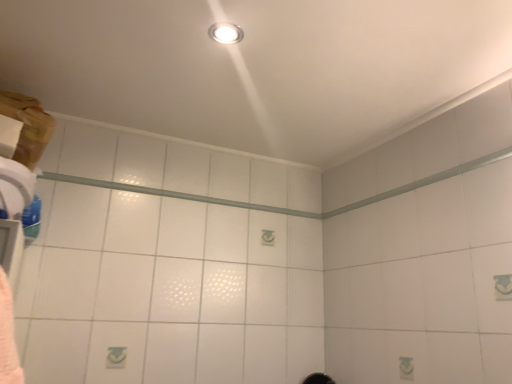
Question: From the image's perspective, is matte silver light fixture at upper center above or below clear glass beam at upper center?

Choices:
 (A) above
 (B) below

Answer: (A)

Question: In terms of width, does matte silver light fixture at upper center look wider or thinner when compared to clear glass beam at upper center?

Choices:
 (A) wide
 (B) thin

Answer: (A)

Question: Based on their positions, is matte silver light fixture at upper center located to the left or right of clear glass beam at upper center?

Choices:
 (A) left
 (B) right

Answer: (B)

Question: Is clear glass beam at upper center in front of or behind matte silver light fixture at upper center in the image?

Choices:
 (A) behind
 (B) front

Answer: (A)

Question: Does point (175, 190) appear closer or farther from the camera than point (234, 28)?

Choices:
 (A) farther
 (B) closer

Answer: (A)

Question: From a real-world perspective, relative to matte silver light fixture at upper center, is clear glass beam at upper center vertically above or below?

Choices:
 (A) above
 (B) below

Answer: (B)

Question: In terms of height, does clear glass beam at upper center look taller or shorter compared to matte silver light fixture at upper center?

Choices:
 (A) short
 (B) tall

Answer: (B)